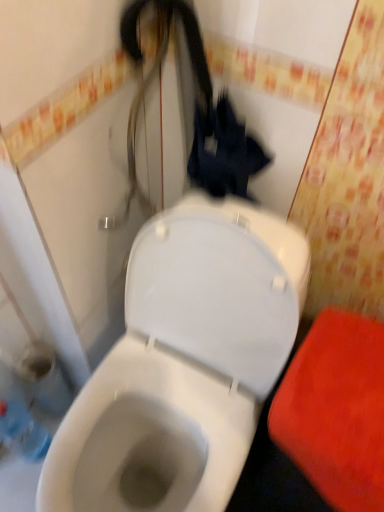
Locate an element on the screen. white glossy toilet at center is located at coordinates (187, 356).

Image resolution: width=384 pixels, height=512 pixels. What do you see at coordinates (187, 356) in the screenshot?
I see `white glossy toilet at center` at bounding box center [187, 356].

In order to click on white glossy toilet at center in this screenshot , I will do `click(187, 356)`.